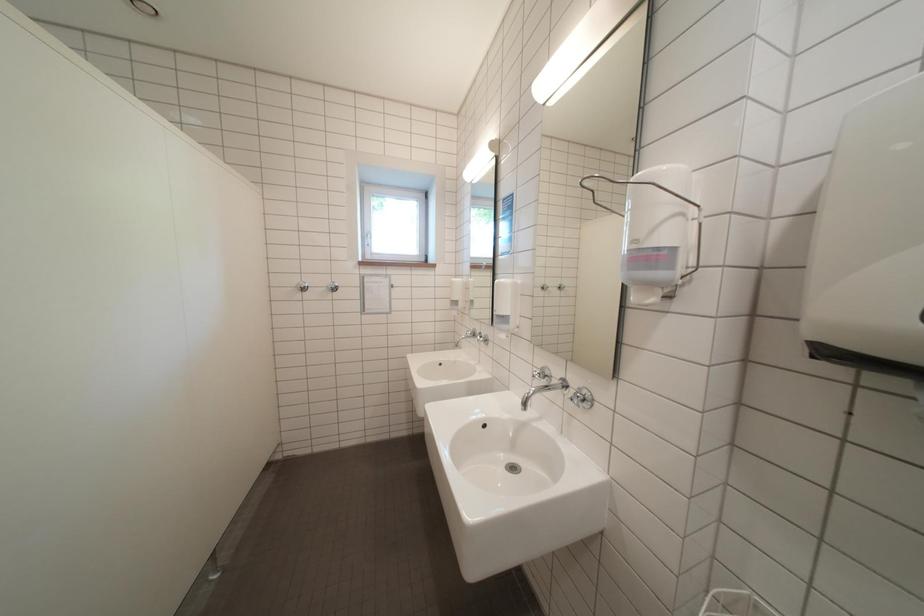
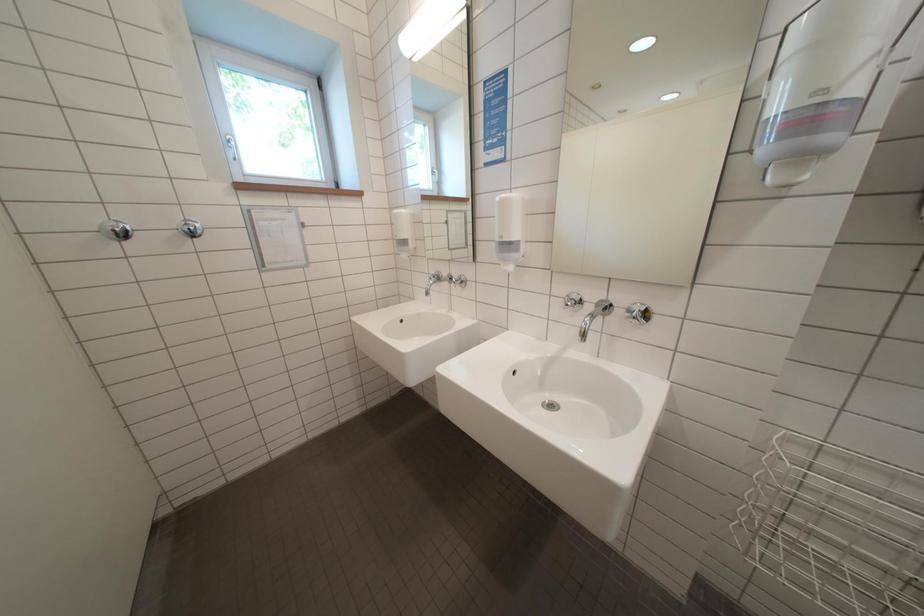
Question: How did the camera likely rotate?

Choices:
 (A) Left
 (B) Right
 (C) Up
 (D) Down

Answer: (B)